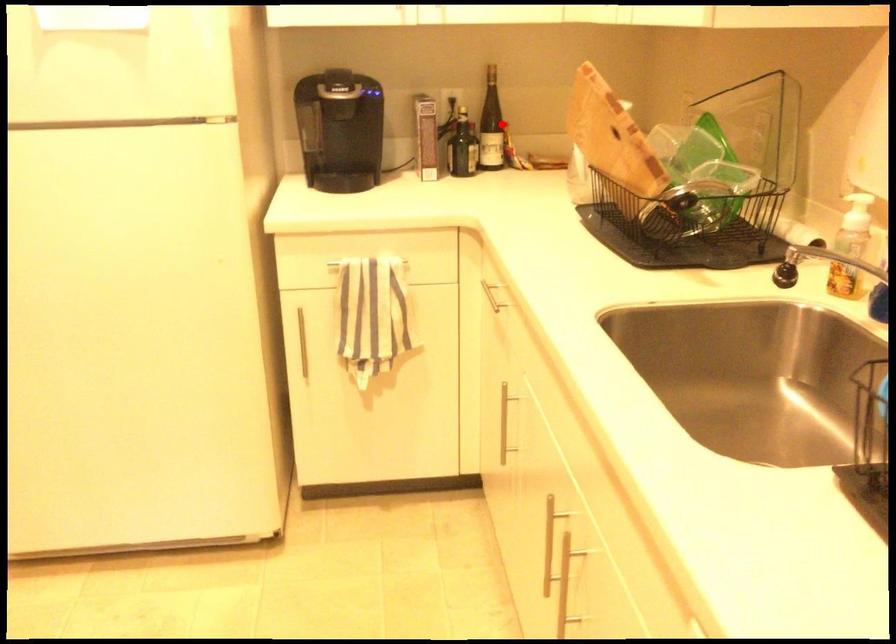
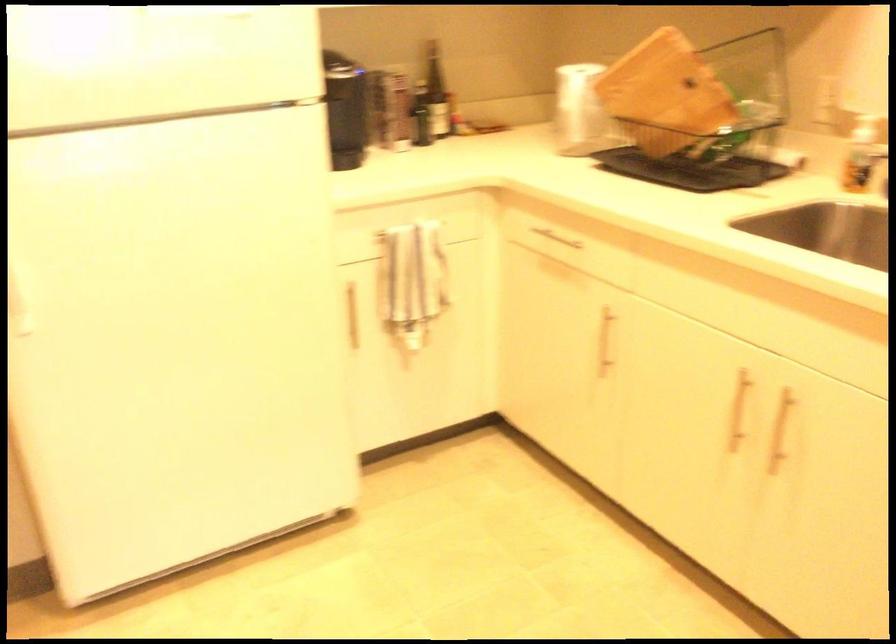
Locate, in the second image, the point that corresponds to the highlighted location in the first image.

(435, 91)